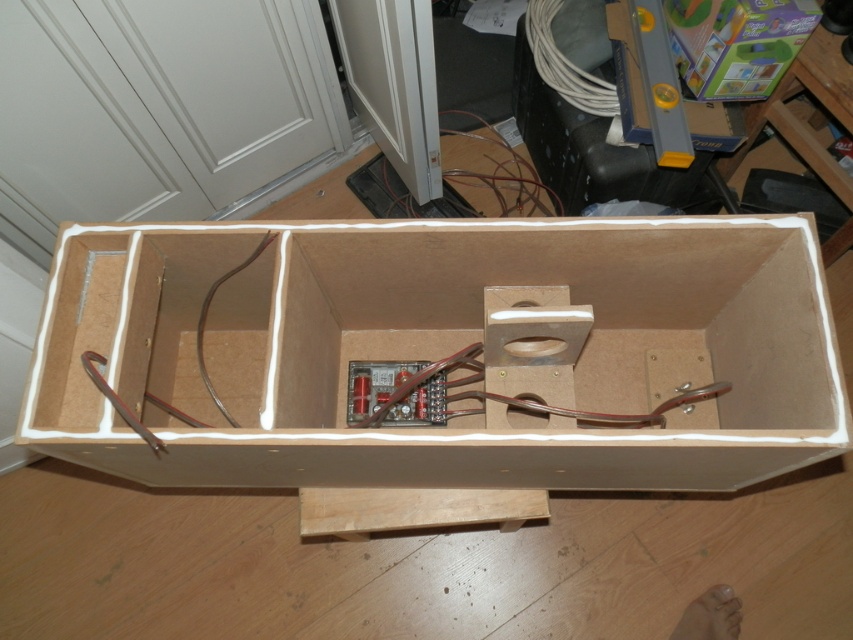
Can you confirm if brown cardboard box at center is positioned below green cardboard box at upper right?

Yes.

Does brown cardboard box at center have a smaller size compared to green cardboard box at upper right?

No.

I want to click on brown cardboard box at center, so click(444, 349).

What do you see at coordinates (444, 349) in the screenshot? Image resolution: width=853 pixels, height=640 pixels. I see `brown cardboard box at center` at bounding box center [444, 349].

Looking at this image, does brown cardboard box at center have a lesser width compared to white cable at upper right?

Incorrect, brown cardboard box at center's width is not less than white cable at upper right's.

This screenshot has width=853, height=640. In order to click on brown cardboard box at center in this screenshot , I will do `click(444, 349)`.

Does green cardboard box at upper right come in front of white cable at upper right?

Yes, green cardboard box at upper right is closer to the viewer.

Between green cardboard box at upper right and white cable at upper right, which one has more height?

white cable at upper right is taller.

Between point (759, 22) and point (585, 90), which one is positioned in front?

Point (759, 22)

You are a GUI agent. You are given a task and a screenshot of the screen. Output one action in this format:
    pyautogui.click(x=<x>, y=<y>)
    Task: Click on the green cardboard box at upper right
    
    Given the screenshot: What is the action you would take?
    pyautogui.click(x=735, y=44)